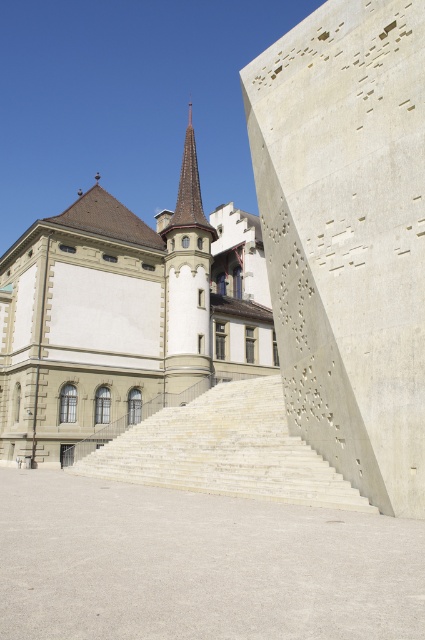
Measure the distance from gray concrete stairs at lower center to white stone building at center.

47.66 meters

Can you confirm if gray concrete stairs at lower center is taller than white stone building at center?

No.

Image resolution: width=425 pixels, height=640 pixels. I want to click on gray concrete stairs at lower center, so click(x=198, y=564).

Does gray concrete stairs at lower center appear on the left side of white stone stairs at center?

No, gray concrete stairs at lower center is not to the left of white stone stairs at center.

Which is below, gray concrete stairs at lower center or white stone stairs at center?

white stone stairs at center is lower down.

This screenshot has width=425, height=640. What do you see at coordinates (198, 564) in the screenshot? I see `gray concrete stairs at lower center` at bounding box center [198, 564].

Where is `gray concrete stairs at lower center`? gray concrete stairs at lower center is located at coordinates (198, 564).

Consider the image. Does white stone building at center have a smaller size compared to white stone stairs at center?

No, white stone building at center is not smaller than white stone stairs at center.

Can you confirm if white stone building at center is positioned to the left of white stone stairs at center?

Indeed, white stone building at center is positioned on the left side of white stone stairs at center.

Is point (155, 333) closer to camera compared to point (121, 449)?

No, it is behind (121, 449).

Image resolution: width=425 pixels, height=640 pixels. Find the location of `white stone building at center`. white stone building at center is located at coordinates (125, 317).